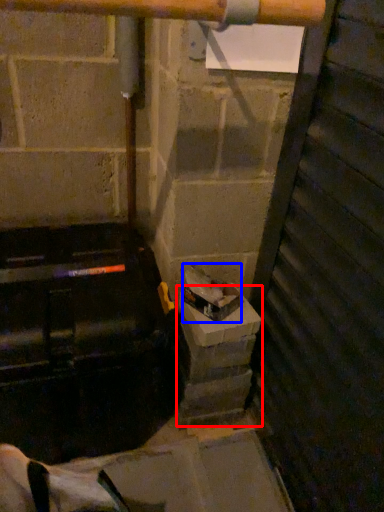
Question: Which object is further to the camera taking this photo, concrete (highlighted by a red box) or garbage (highlighted by a blue box)?

Choices:
 (A) concrete
 (B) garbage

Answer: (A)